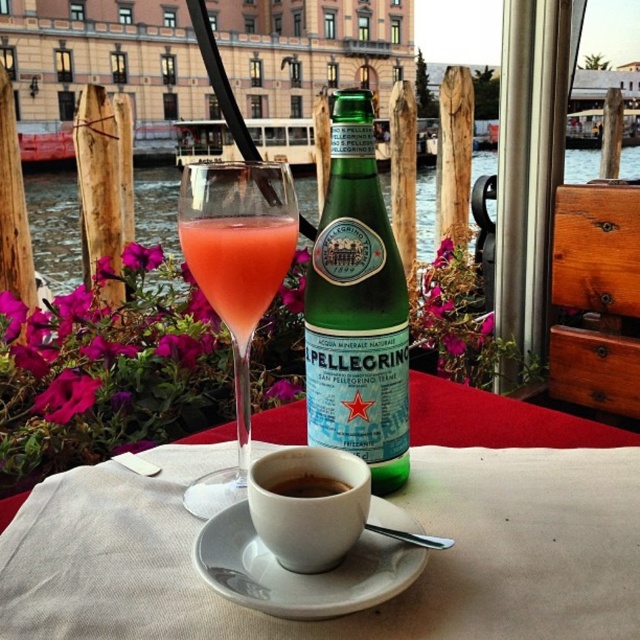
Question: Is matte white cup at center wider than translucent glass at center?

Choices:
 (A) no
 (B) yes

Answer: (A)

Question: Which of the following is the closest to the observer?

Choices:
 (A) (330, 433)
 (B) (291, 477)

Answer: (B)

Question: Which point appears farthest from the camera in this image?

Choices:
 (A) (266, 474)
 (B) (371, 592)

Answer: (A)

Question: Which of these objects is positioned farthest from the brown matte cup at center?

Choices:
 (A) matte white cup at center
 (B) translucent glass at center
 (C) pink liquid at center
 (D) white ceramic saucer at center

Answer: (C)

Question: Can you confirm if white ceramic cup at center is smaller than pink liquid at center?

Choices:
 (A) no
 (B) yes

Answer: (B)

Question: Does translucent glass at center lie behind brown matte cup at center?

Choices:
 (A) yes
 (B) no

Answer: (A)